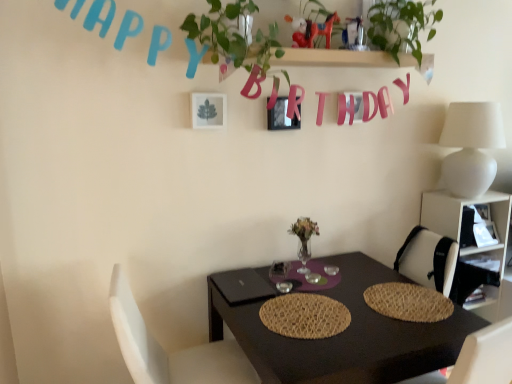
Question: Is woven straw placemat at center, the second mat positioned from the left, positioned behind white plastic shelf at right?

Choices:
 (A) yes
 (B) no

Answer: (B)

Question: Is woven straw placemat at center, the second mat positioned from the left, surrounding white plastic shelf at right?

Choices:
 (A) yes
 (B) no

Answer: (B)

Question: Is woven straw placemat at center, the second mat positioned from the left, closer to camera compared to white plastic shelf at right?

Choices:
 (A) yes
 (B) no

Answer: (A)

Question: From a real-world perspective, is woven straw placemat at center, the second mat positioned from the left, located higher than white plastic shelf at right?

Choices:
 (A) no
 (B) yes

Answer: (B)

Question: From the image's perspective, is woven straw placemat at center, the second mat positioned from the left, on top of white plastic shelf at right?

Choices:
 (A) no
 (B) yes

Answer: (A)

Question: From their relative heights in the image, would you say green leafy plant at upper center is taller or shorter than black matte table at center?

Choices:
 (A) short
 (B) tall

Answer: (A)

Question: From the image's perspective, is green leafy plant at upper center located above or below black matte table at center?

Choices:
 (A) above
 (B) below

Answer: (A)

Question: Relative to black matte table at center, is green leafy plant at upper center in front or behind?

Choices:
 (A) front
 (B) behind

Answer: (B)

Question: Would you say green leafy plant at upper center is to the left or to the right of black matte table at center in the picture?

Choices:
 (A) right
 (B) left

Answer: (B)

Question: From the image's perspective, relative to white plastic shelf at right, is white matte table lamp at upper right above or below?

Choices:
 (A) below
 (B) above

Answer: (B)

Question: Choose the correct answer: Is white matte table lamp at upper right inside white plastic shelf at right or outside it?

Choices:
 (A) inside
 (B) outside

Answer: (B)

Question: Relative to white plastic shelf at right, is white matte table lamp at upper right in front or behind?

Choices:
 (A) behind
 (B) front

Answer: (B)

Question: Is white matte table lamp at upper right bigger or smaller than white plastic shelf at right?

Choices:
 (A) small
 (B) big

Answer: (A)

Question: From a real-world perspective, is green leafy plant at upper right positioned above or below black matte table at center?

Choices:
 (A) above
 (B) below

Answer: (A)

Question: Is green leafy plant at upper right situated inside black matte table at center or outside?

Choices:
 (A) outside
 (B) inside

Answer: (A)